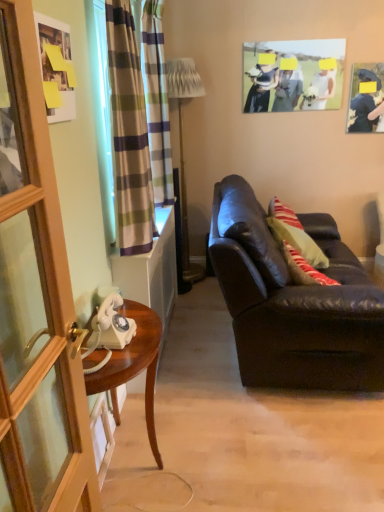
Identify the location of free point behind wooden desk at left. (181, 400).